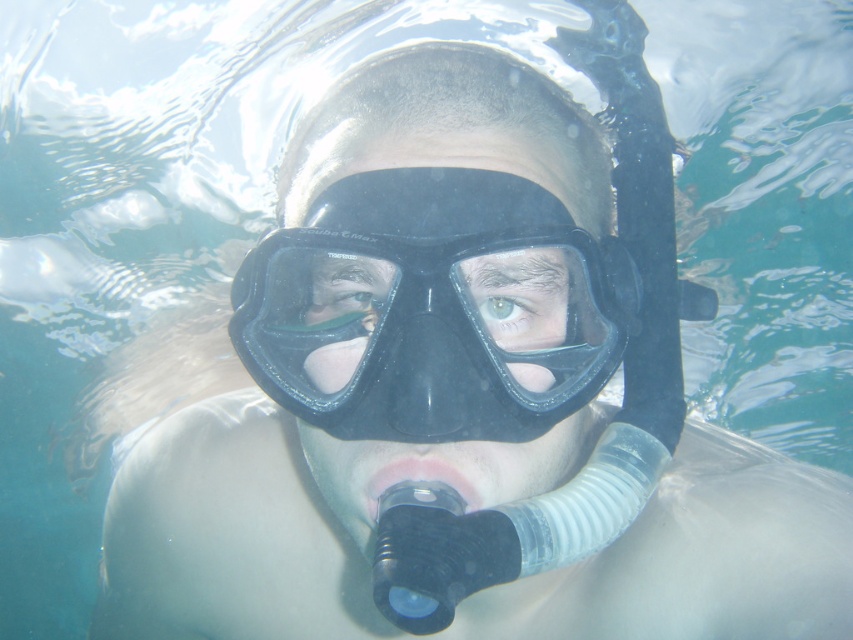
Does black rubber goggles at center have a larger size compared to green matte eye at center?

Correct, black rubber goggles at center is larger in size than green matte eye at center.

Who is shorter, black rubber goggles at center or green matte eye at center?

green matte eye at center is shorter.

Image resolution: width=853 pixels, height=640 pixels. In order to click on black rubber goggles at center in this screenshot , I will do `click(426, 308)`.

This screenshot has width=853, height=640. I want to click on black rubber goggles at center, so click(x=426, y=308).